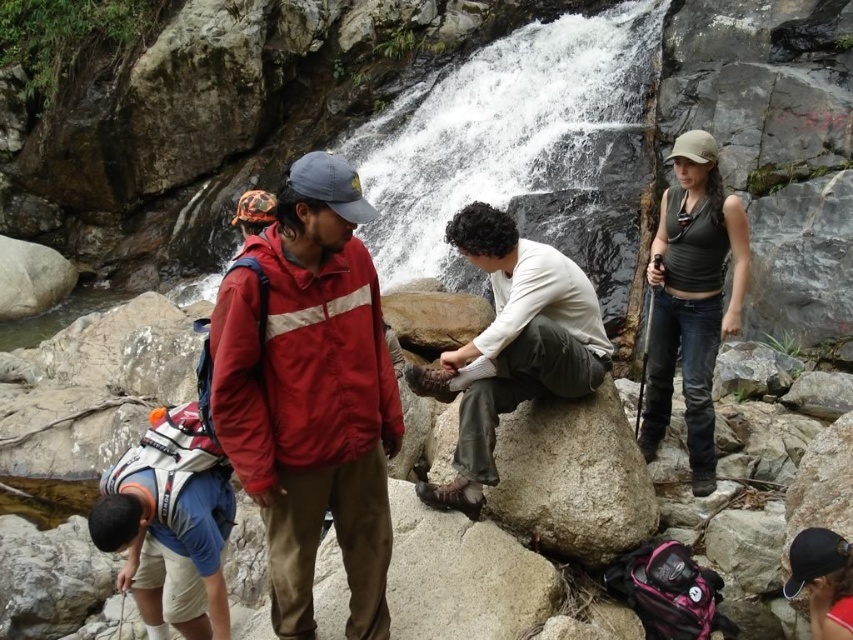
Does point (508, 358) come farther from viewer compared to point (692, 493)?

No.

Which is behind, point (532, 348) or point (721, 257)?

Point (721, 257)

The image size is (853, 640). In order to click on white matte shirt at center in this screenshot , I will do `click(512, 346)`.

Does matte red jacket at center have a larger size compared to white matte shirt at center?

Correct, matte red jacket at center is larger in size than white matte shirt at center.

Does point (334, 198) lie in front of point (527, 346)?

That is True.

Is point (315, 410) farther from camera compared to point (427, 488)?

That is False.

You are a GUI agent. You are given a task and a screenshot of the screen. Output one action in this format:
    pyautogui.click(x=<x>, y=<y>)
    Task: Click on the matte red jacket at center
    This screenshot has height=640, width=853.
    Given the screenshot: What is the action you would take?
    pyautogui.click(x=311, y=396)

Does matte red jacket at center have a greater width compared to matte green tank top at right?

Yes, matte red jacket at center is wider than matte green tank top at right.

Where is `matte red jacket at center`? The image size is (853, 640). matte red jacket at center is located at coordinates (311, 396).